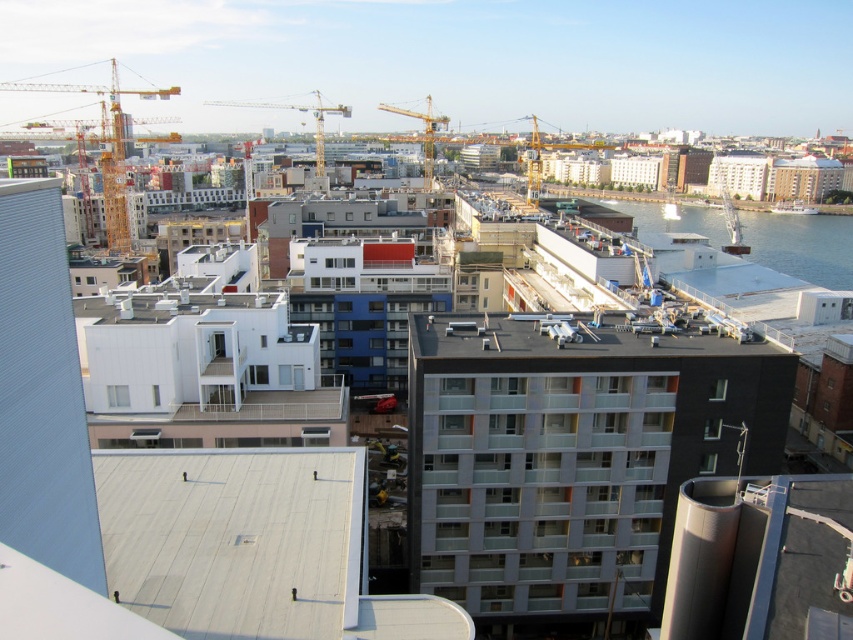
Between clear blue water at lower right and metallic yellow crane at center, which one is positioned higher?

metallic yellow crane at center is higher up.

Consider the image. Is clear blue water at lower right to the right of metallic yellow crane at center from the viewer's perspective?

Yes, clear blue water at lower right is to the right of metallic yellow crane at center.

Who is more forward, (779, 260) or (234, 106)?

Point (779, 260) is in front.

At what (x,y) coordinates should I click in order to perform the action: click on clear blue water at lower right. Please return your answer as a coordinate pair (x, y). The width and height of the screenshot is (853, 640). Looking at the image, I should click on (802, 244).

Does matte glass building at center have a smaller size compared to yellow metallic crane at center?

Correct, matte glass building at center occupies less space than yellow metallic crane at center.

Is point (532, 467) farther from viewer compared to point (426, 177)?

That is False.

Where is `matte glass building at center`? matte glass building at center is located at coordinates (572, 456).

Is matte glass building at center positioned before clear blue water at lower right?

Yes.

Between matte glass building at center and clear blue water at lower right, which one is positioned higher?

Positioned higher is clear blue water at lower right.

The width and height of the screenshot is (853, 640). Find the location of `matte glass building at center`. matte glass building at center is located at coordinates (572, 456).